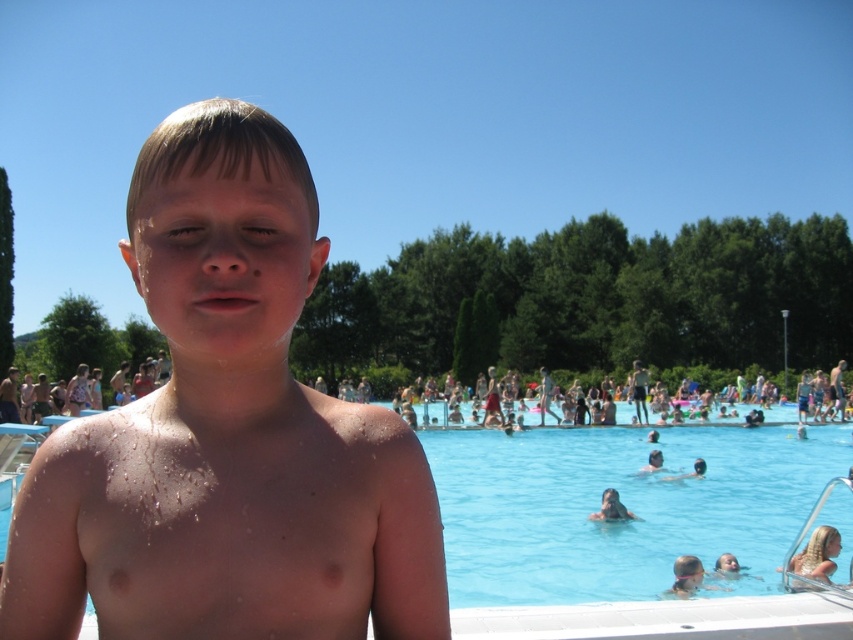
Question: Which point appears closest to the camera in this image?

Choices:
 (A) (170, 403)
 (B) (622, 515)
 (C) (695, 438)

Answer: (A)

Question: Can you confirm if shiny wet skin at center is positioned below smooth skin child at center?

Choices:
 (A) no
 (B) yes

Answer: (A)

Question: Where is shiny wet skin at center located in relation to blue smooth water at center in the image?

Choices:
 (A) right
 (B) left

Answer: (B)

Question: Can you confirm if shiny wet skin at center is wider than smooth skin child at center?

Choices:
 (A) no
 (B) yes

Answer: (B)

Question: Which object is positioned closest to the smooth skin child at center?

Choices:
 (A) blue smooth water at center
 (B) shiny wet skin at center

Answer: (A)

Question: Which point appears farthest from the camera in this image?

Choices:
 (A) (488, 611)
 (B) (231, 532)
 (C) (602, 508)

Answer: (C)